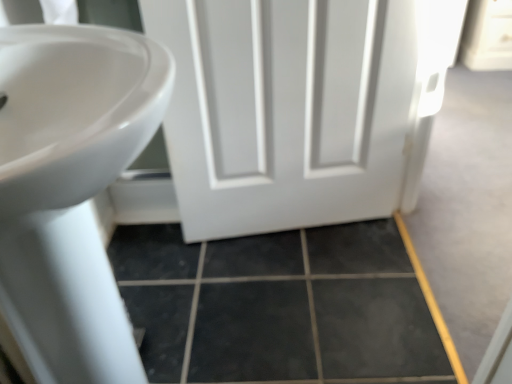
The image size is (512, 384). I want to click on free space in front of white matte door at center, so [x=316, y=296].